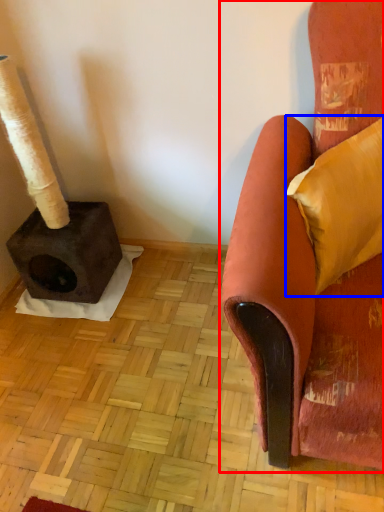
Question: Which object is closer to the camera taking this photo, chair (highlighted by a red box) or pillow (highlighted by a blue box)?

Choices:
 (A) chair
 (B) pillow

Answer: (A)